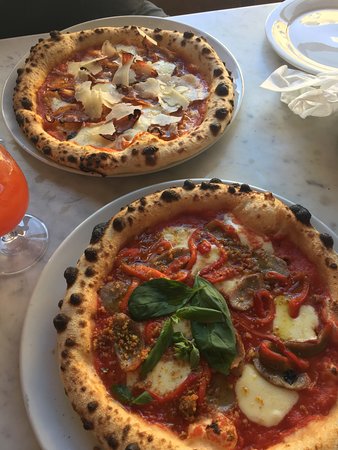
At what (x,y) coordinates should I click in order to perform the action: click on white plate. Please return your answer as a coordinate pair (x, y). The width and height of the screenshot is (338, 450). Looking at the image, I should click on (55, 366).